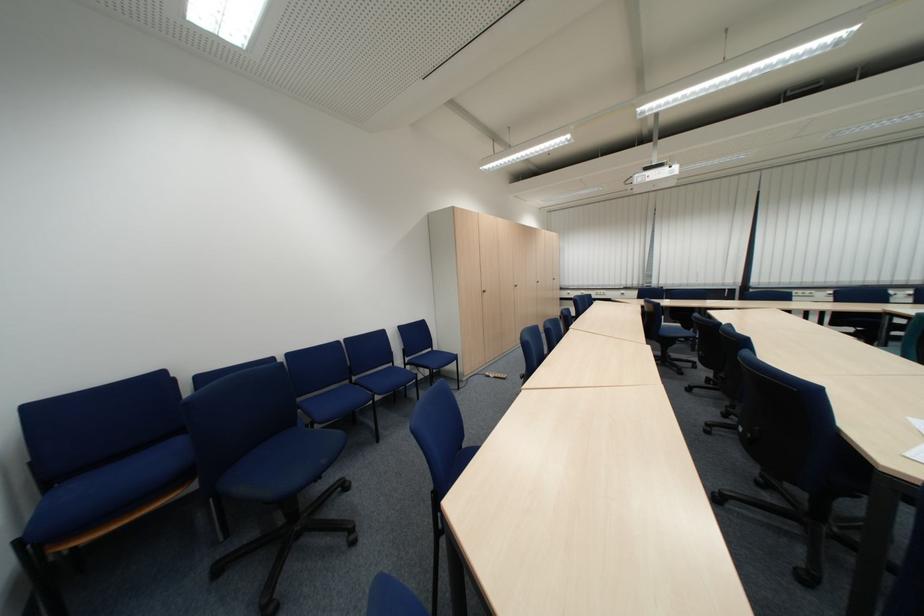
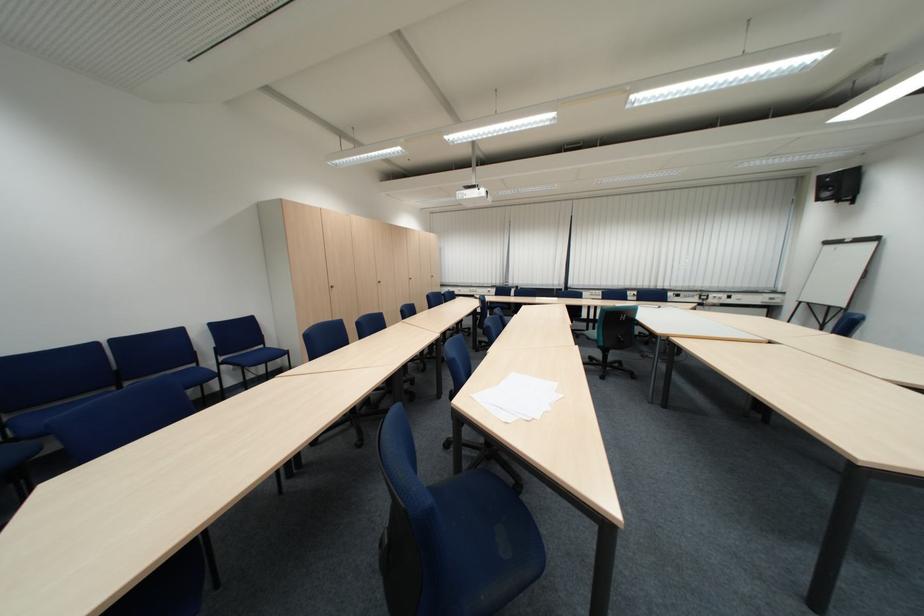
In a continuous first-person perspective shot, in which direction is the camera moving?

The cameraman moved toward right, backward.